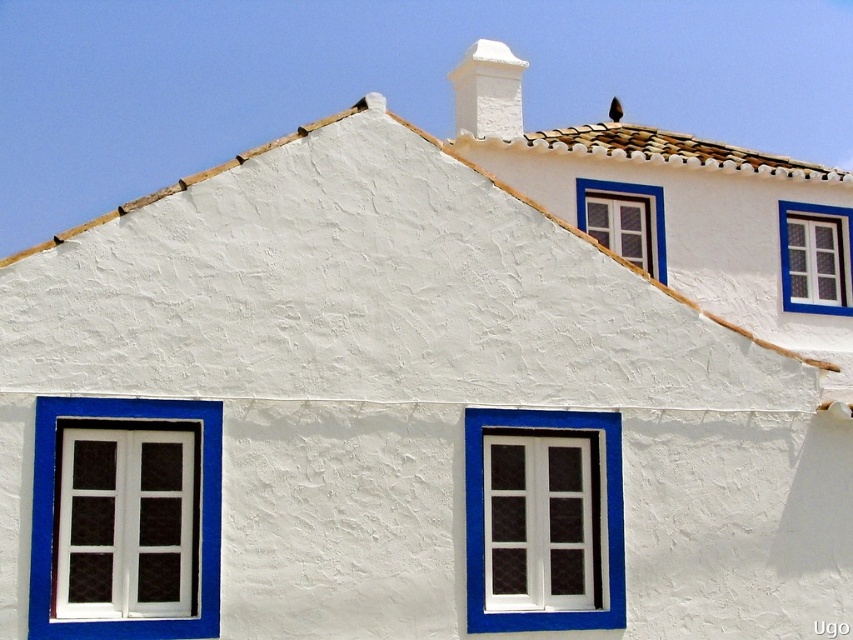
Which is more to the right, white painted wood window at lower left or brown clay tiles at upper center?

Positioned to the right is brown clay tiles at upper center.

Does white painted wood window at lower left come behind brown clay tiles at upper center?

That is False.

Does point (190, 621) come in front of point (648, 140)?

Yes, point (190, 621) is in front of point (648, 140).

This screenshot has height=640, width=853. What are the coordinates of `white painted wood window at lower left` in the screenshot? It's located at (x=53, y=516).

Which is in front, point (517, 83) or point (576, 196)?

Point (576, 196)

Is white stucco chimney at upper center in front of white painted wood window at upper center?

Yes.

Is point (515, 109) positioned after point (582, 182)?

Yes, it is.

Identify the location of white stucco chimney at upper center. coord(488,92).

What do you see at coordinates (483, 518) in the screenshot? This screenshot has height=640, width=853. I see `white painted wood window at center` at bounding box center [483, 518].

This screenshot has height=640, width=853. Describe the element at coordinates (483, 518) in the screenshot. I see `white painted wood window at center` at that location.

Identify the location of white painted wood window at center. The width and height of the screenshot is (853, 640). (483, 518).